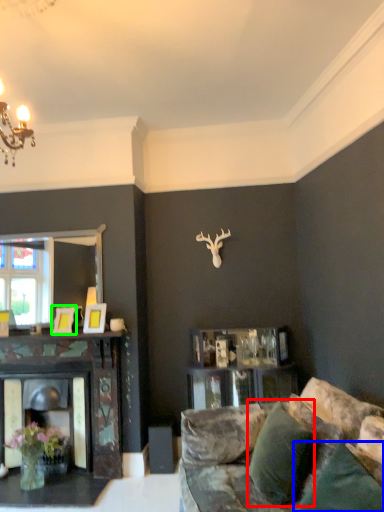
Question: Which object is positioned closest to pillow (highlighted by a red box)? Select from pillow (highlighted by a blue box) and picture frame (highlighted by a green box).

Choices:
 (A) pillow
 (B) picture frame

Answer: (A)